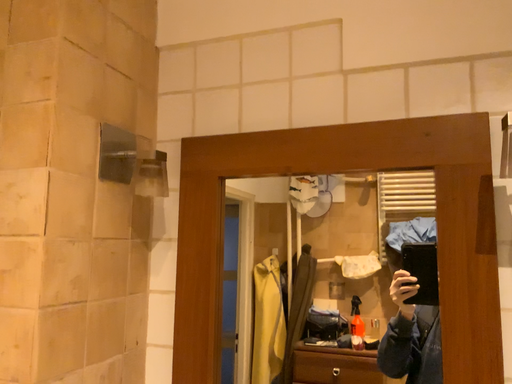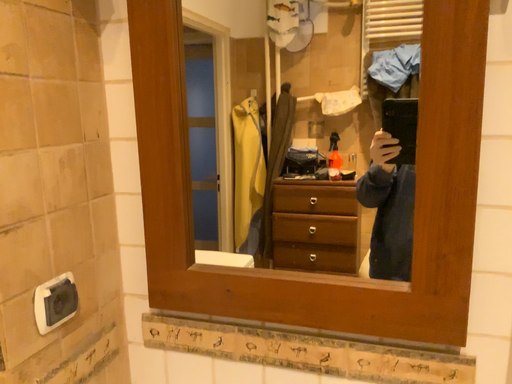
Question: Which way did the camera rotate in the video?

Choices:
 (A) rotated upward
 (B) rotated downward

Answer: (B)